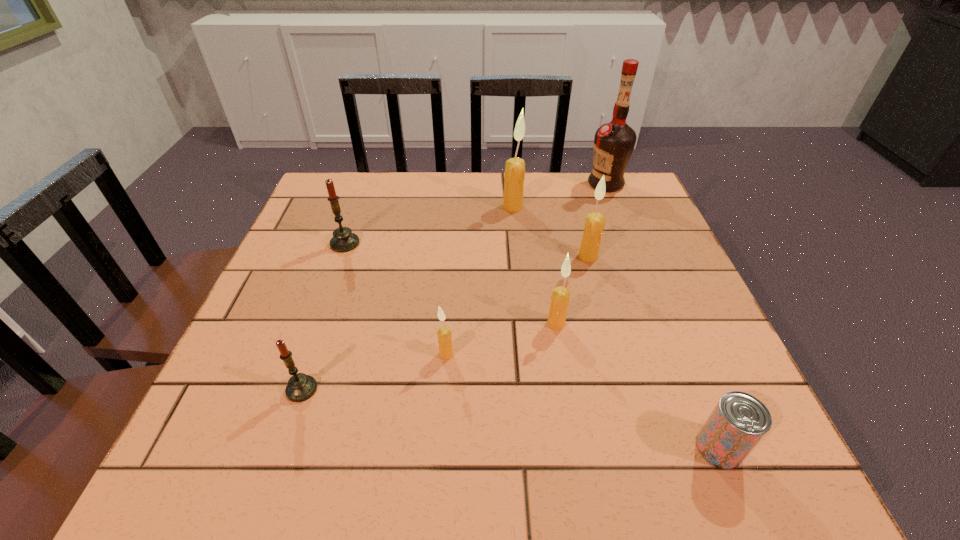
This screenshot has height=540, width=960. I want to click on free region located 0.150m on the right of the bigger red candle, so click(420, 244).

This screenshot has height=540, width=960. Find the location of `free space located on the left of the fifth candle from left to right`. free space located on the left of the fifth candle from left to right is located at coordinates (522, 323).

The width and height of the screenshot is (960, 540). In order to click on blank area located on the front of the second nearest object in this screenshot , I will do `click(280, 453)`.

You are a GUI agent. You are given a task and a screenshot of the screen. Output one action in this format:
    pyautogui.click(x=<x>, y=<y>)
    Task: Click on the blank area located 0.140m on the back of the leftmost cream candle
    
    Given the screenshot: What is the action you would take?
    [450, 296]

This screenshot has width=960, height=540. I want to click on vacant space located on the back of the nearest object, so click(685, 367).

Find the location of `liquor positioned at the far edge`. liquor positioned at the far edge is located at coordinates pyautogui.click(x=614, y=142).

At what (x,y) coordinates should I click in order to perform the action: click on candle located at the far edge. Please return your answer as a coordinate pair (x, y). The image size is (960, 540). Looking at the image, I should click on (514, 176).

Find the location of a particular element. object that is at the near edge is located at coordinates (739, 421).

This screenshot has height=540, width=960. Find the location of `liquor at the right edge`. liquor at the right edge is located at coordinates (614, 142).

The height and width of the screenshot is (540, 960). Identify the location of beer can that is at the right edge. (739, 421).